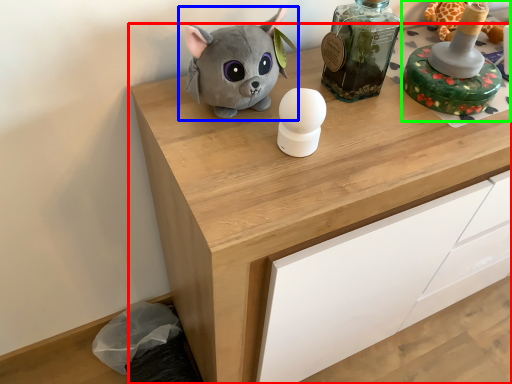
Question: Considering the real-world distances, which object is closest to chest of drawers (highlighted by a red box)? toy (highlighted by a blue box) or toy (highlighted by a green box).

Choices:
 (A) toy
 (B) toy

Answer: (A)